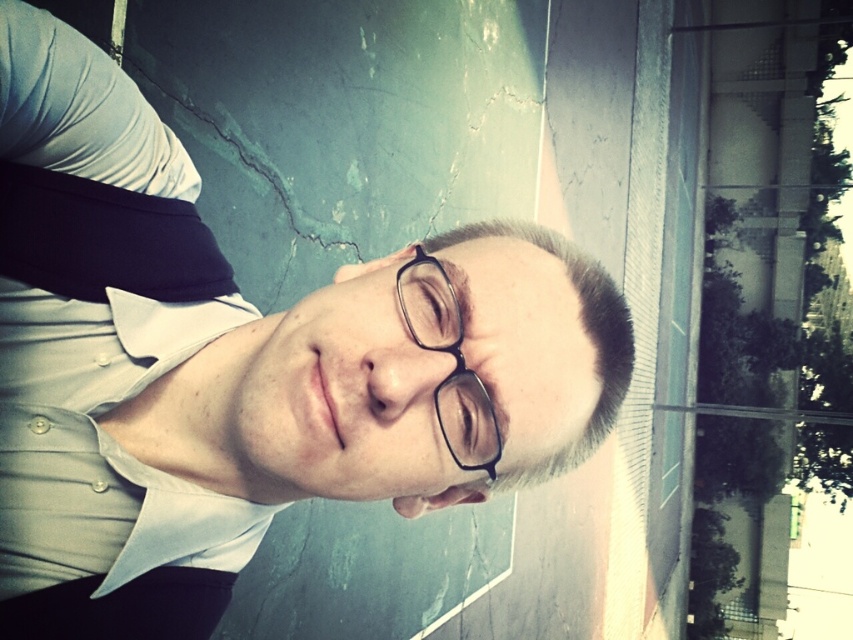
Question: Is white cotton dress shirt at center below black plastic glasses at center?

Choices:
 (A) no
 (B) yes

Answer: (A)

Question: Which object appears farthest from the camera in this image?

Choices:
 (A) white shirt at center
 (B) black plastic glasses at center

Answer: (B)

Question: Which point is farther from the camera taking this photo?

Choices:
 (A) (438, 401)
 (B) (102, 547)
 (C) (431, 493)

Answer: (B)

Question: Does white shirt at center have a lesser width compared to white cotton dress shirt at center?

Choices:
 (A) no
 (B) yes

Answer: (A)

Question: Which object is the closest to the white shirt at center?

Choices:
 (A) white cotton dress shirt at center
 (B) black plastic glasses at center

Answer: (A)

Question: Can you confirm if white cotton dress shirt at center is thinner than black plastic glasses at center?

Choices:
 (A) no
 (B) yes

Answer: (A)